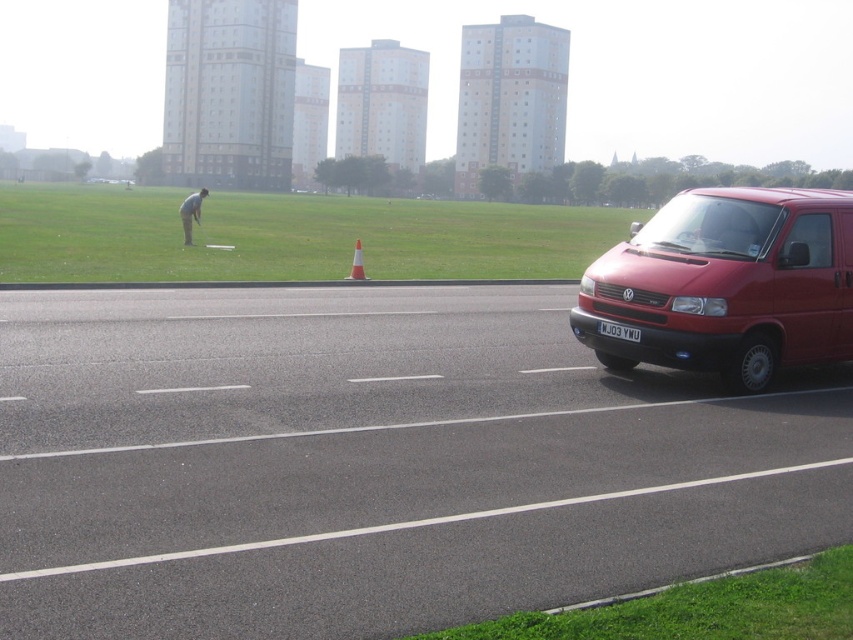
Does matte red van at right have a lesser width compared to smooth gray shirt at center?

Correct, matte red van at right's width is less than smooth gray shirt at center's.

Does matte red van at right have a greater height compared to smooth gray shirt at center?

No.

Between point (840, 323) and point (181, 218), which one is positioned behind?

The point (181, 218) is more distant.

Locate an element on the screen. Image resolution: width=853 pixels, height=640 pixels. matte red van at right is located at coordinates (727, 284).

Which is behind, point (190, 216) or point (357, 266)?

Point (190, 216)

Does smooth gray shirt at center have a larger size compared to orange cone at center?

Correct, smooth gray shirt at center is larger in size than orange cone at center.

Is point (189, 204) farther from viewer compared to point (363, 260)?

Yes, point (189, 204) is behind point (363, 260).

In order to click on smooth gray shirt at center in this screenshot , I will do `click(190, 212)`.

From the picture: Can you confirm if black plastic license plate at center is smaller than orange cone at center?

Yes.

Is black plastic license plate at center thinner than orange cone at center?

Correct, black plastic license plate at center's width is less than orange cone at center's.

What do you see at coordinates (618, 330) in the screenshot?
I see `black plastic license plate at center` at bounding box center [618, 330].

Locate an element on the screen. black plastic license plate at center is located at coordinates (618, 330).